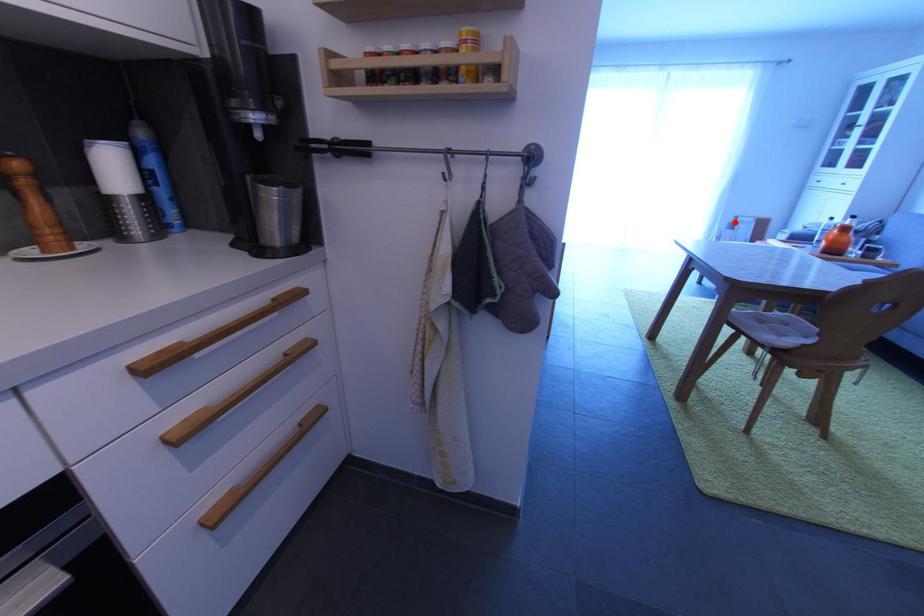
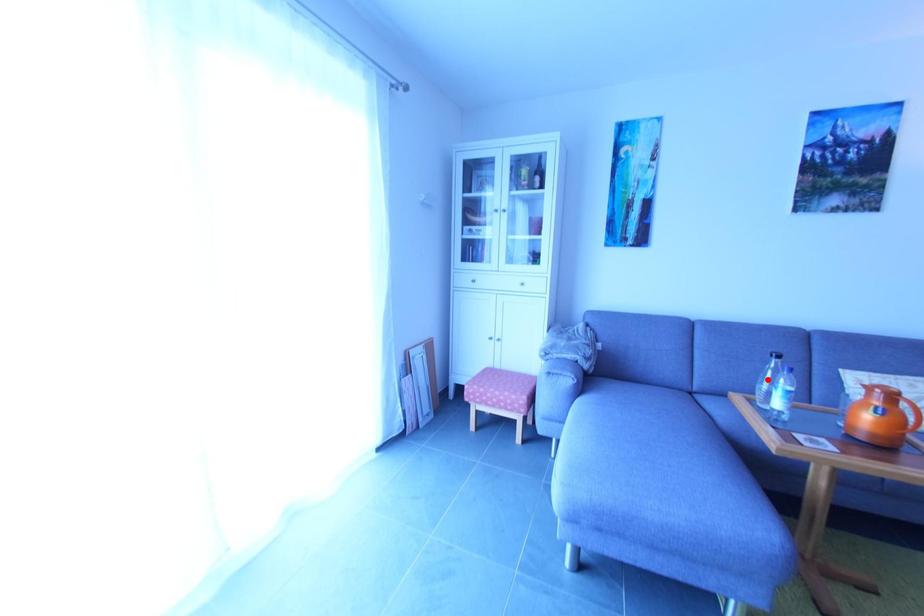
I am providing you with two images of the same scene from different viewpoints. A red point is marked on the first image and another point is marked on the second image. Is the red point in image1 aligned with the point shown in image2?

No